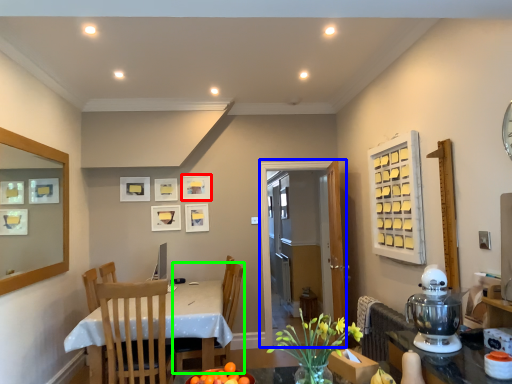
Question: Which object is the farthest from picture frame (highlighted by a red box)? Choose among these: glass door (highlighted by a blue box) or chair (highlighted by a green box).

Choices:
 (A) glass door
 (B) chair

Answer: (B)